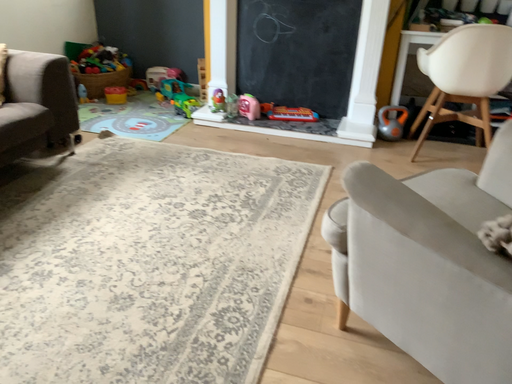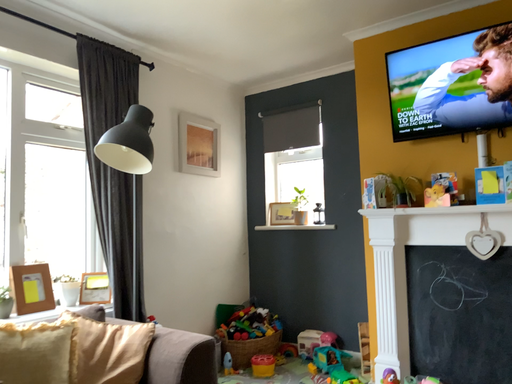
Question: How did the camera likely rotate when shooting the video?

Choices:
 (A) rotated right
 (B) rotated left

Answer: (B)